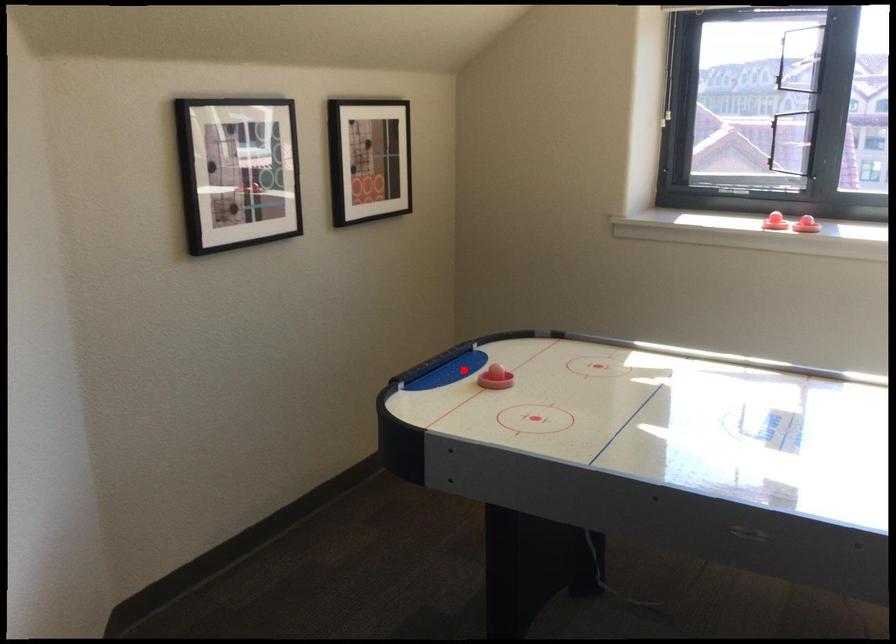
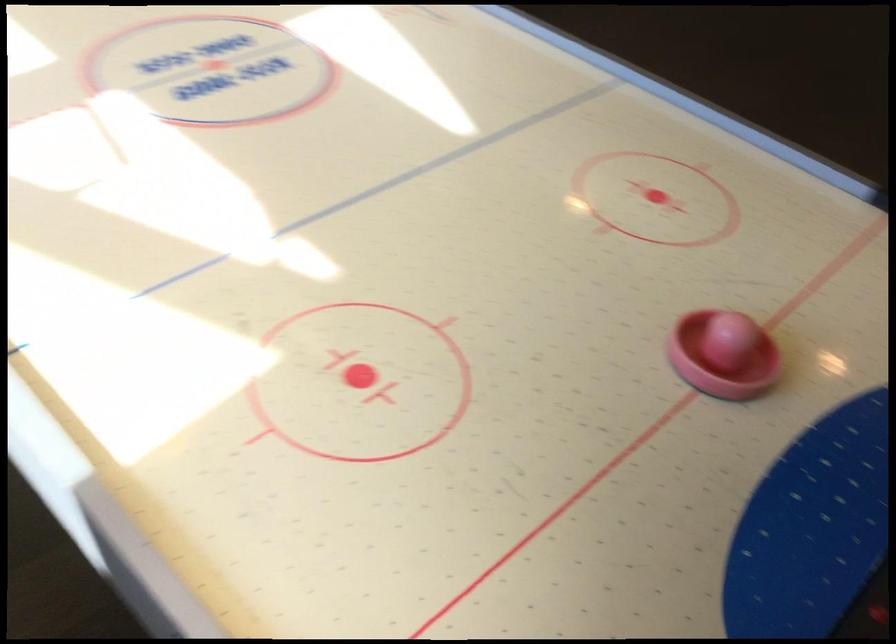
Question: I am providing you with two images of the same scene from different viewpoints. A red point is marked on the first image. At the location where the point appears in image 1, is it still visible in image 2?

Choices:
 (A) Yes
 (B) No

Answer: (A)